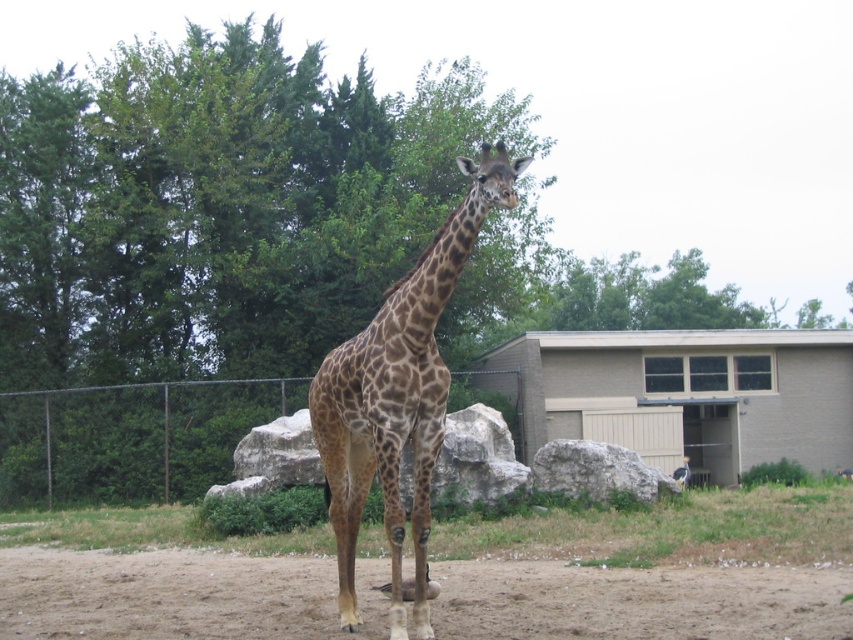
Question: Can you confirm if metallic chain-link fence at center is positioned above gray rough rock at center?

Choices:
 (A) no
 (B) yes

Answer: (A)

Question: Is spotted fur giraffe at center to the right of gray rough rock at center from the viewer's perspective?

Choices:
 (A) yes
 (B) no

Answer: (B)

Question: Among these objects, which one is farthest from the camera?

Choices:
 (A) metallic chain-link fence at center
 (B) brown sandy dirt at lower center

Answer: (A)

Question: Estimate the real-world distances between objects in this image. Which object is farther from the brown sandy dirt at lower center?

Choices:
 (A) spotted fur giraffe at center
 (B) metallic chain-link fence at center
 (C) gray rough rock at center

Answer: (B)

Question: Is metallic chain-link fence at center positioned before gray rough rock at center?

Choices:
 (A) yes
 (B) no

Answer: (B)

Question: Which object appears closest to the camera in this image?

Choices:
 (A) gray rough rock at center
 (B) brown sandy dirt at lower center
 (C) metallic chain-link fence at center
 (D) spotted fur giraffe at center

Answer: (D)